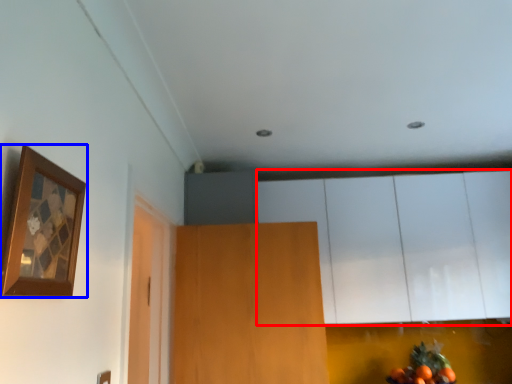
Question: Which object is closer to the camera taking this photo, cabinetry (highlighted by a red box) or picture frame (highlighted by a blue box)?

Choices:
 (A) cabinetry
 (B) picture frame

Answer: (B)